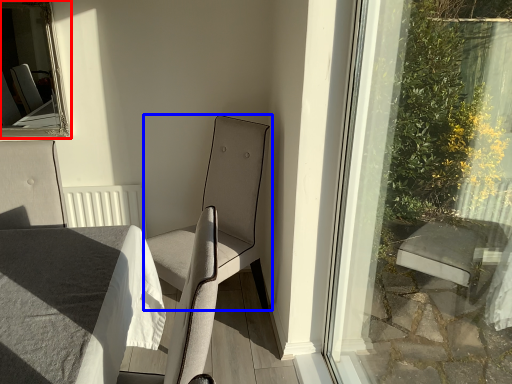
Question: Which of the following is the farthest to the observer, bay window (highlighted by a red box) or chair (highlighted by a blue box)?

Choices:
 (A) bay window
 (B) chair

Answer: (A)